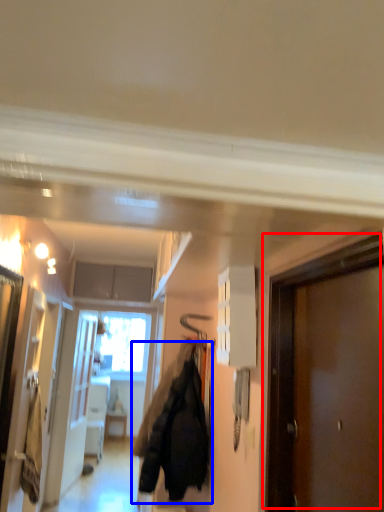
Question: Which point is further to the camera, door (highlighted by a red box) or jacket (highlighted by a blue box)?

Choices:
 (A) door
 (B) jacket

Answer: (B)